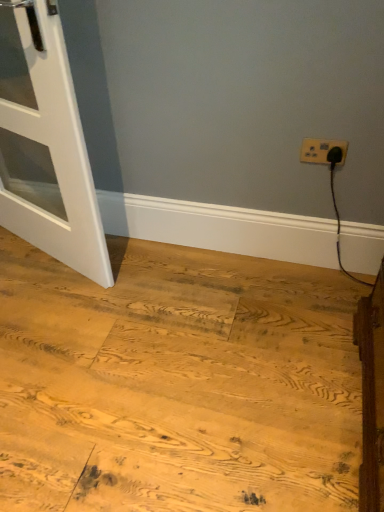
Question: Based on their sizes in the image, would you say natural wood floor at lower left is bigger or smaller than white plastic power plugs and sockets at upper right?

Choices:
 (A) small
 (B) big

Answer: (B)

Question: From the image's perspective, is natural wood floor at lower left above or below white plastic power plugs and sockets at upper right?

Choices:
 (A) below
 (B) above

Answer: (A)

Question: Which of these objects is positioned closest to the natural wood floor at lower left?

Choices:
 (A) white matte door at left
 (B) white plastic power plugs and sockets at upper right

Answer: (A)

Question: Which object is the closest to the natural wood floor at lower left?

Choices:
 (A) white matte door at left
 (B) white plastic power plugs and sockets at upper right

Answer: (A)